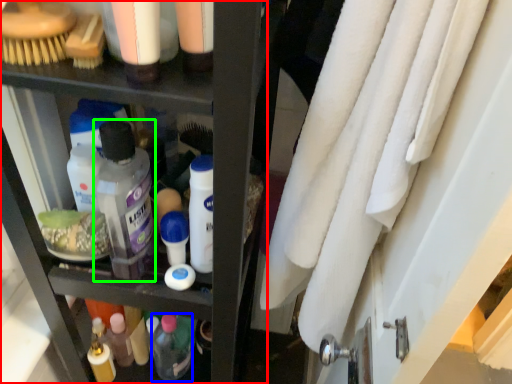
Question: Which object is positioned closest to shelf (highlighted by a red box)? Select from toiletry (highlighted by a blue box) and mouthwash (highlighted by a green box).

Choices:
 (A) toiletry
 (B) mouthwash

Answer: (B)